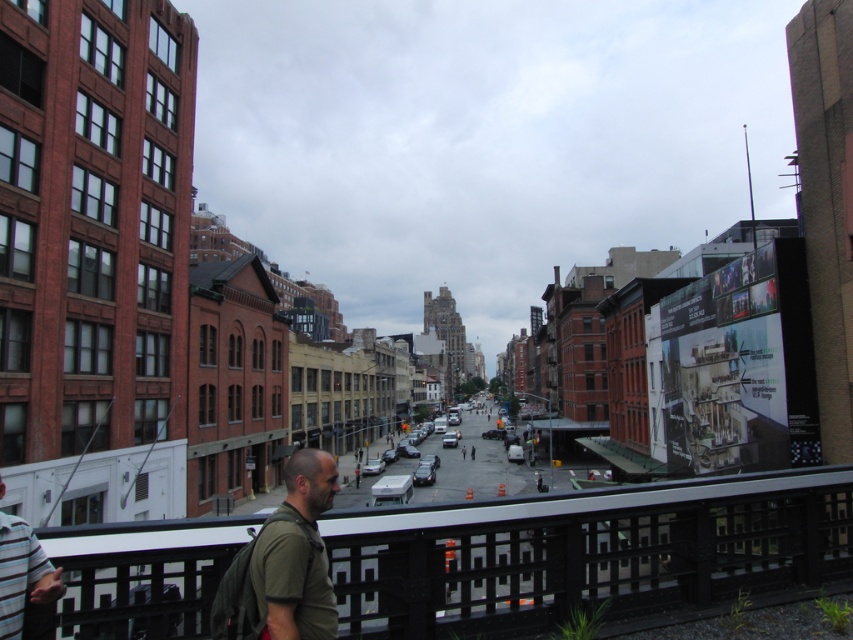
You are standing on a bridge overlooking a busy street. You see the black metal rail at lower center. If you want to cross to the other side of the bridge, which direction should you walk relative to the rail?

To cross to the other side of the bridge, you should walk away from the black metal rail at lower center since it is positioned at the edge of the bridge near point (584, 552).

You are standing at the point labeled as point (584, 552) in the image. What object are you currently standing on?

The point (584, 552) corresponds to the black metal rail at lower center, so you are standing on the black metal rail at lower center.

You are standing on an elevated platform overlooking the street. You see a man in a green matte shirt at lower center and another in a striped cotton shirt at lower left. Which man appears taller from your vantage point?

The green matte shirt at lower center appears much taller than the striped cotton shirt at lower left from your vantage point.